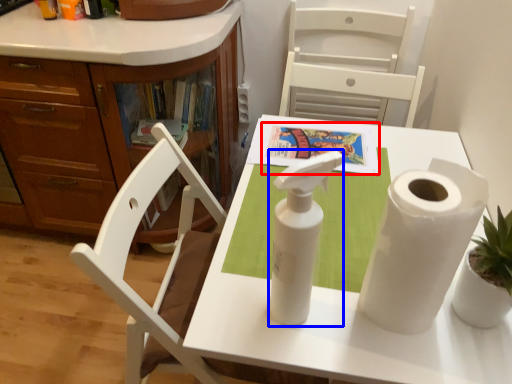
Question: Which object is closer to the camera taking this photo, book (highlighted by a red box) or soap dispenser (highlighted by a blue box)?

Choices:
 (A) book
 (B) soap dispenser

Answer: (B)